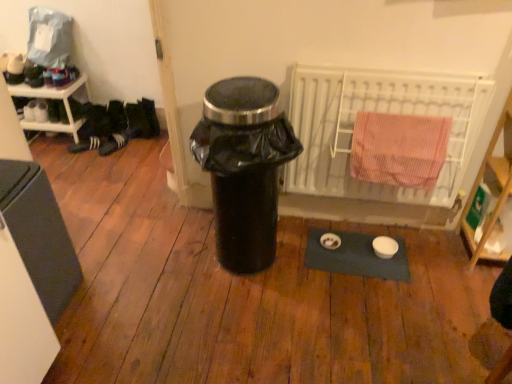
Locate an element on the screen. This screenshot has width=512, height=384. free region on the left part of black matte shoe at left, which is counted as the 2th shoe, starting from the right is located at coordinates coord(48,147).